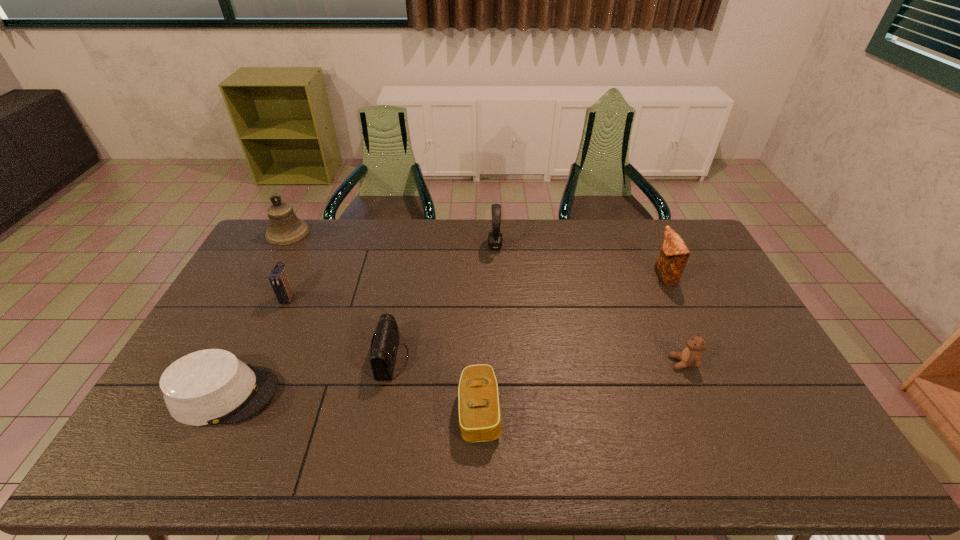
Image resolution: width=960 pixels, height=540 pixels. Identify the location of vacant space located 0.390m on the front flap of the fifth object from right to left. (541, 358).

The height and width of the screenshot is (540, 960). What are the coordinates of `free region located 0.300m on the front-facing side of the hat` in the screenshot? It's located at (388, 394).

You are a GUI agent. You are given a task and a screenshot of the screen. Output one action in this format:
    pyautogui.click(x=<x>, y=<y>)
    Task: Click on the free region located on the zipper side of the second clutch bag from right to left
    The width and height of the screenshot is (960, 540).
    Given the screenshot: What is the action you would take?
    pyautogui.click(x=633, y=411)

Where is `bell that is at the far edge`? bell that is at the far edge is located at coordinates (285, 228).

I want to click on headset that is at the far edge, so click(x=495, y=239).

Find the location of a particular element. This screenshot has height=540, width=960. object at the near edge is located at coordinates (479, 406).

I want to click on bell present at the left edge, so click(x=285, y=228).

This screenshot has height=540, width=960. Find the location of `hat that is positioned at the left edge`. hat that is positioned at the left edge is located at coordinates (212, 386).

Image resolution: width=960 pixels, height=540 pixels. I want to click on object that is at the far left corner, so click(x=285, y=228).

This screenshot has height=540, width=960. I want to click on vacant space at the far edge of the desktop, so click(x=401, y=252).